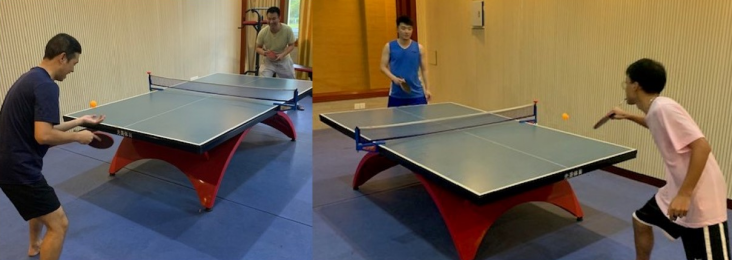
The image size is (732, 260). I want to click on front table legs, so click(113, 171), click(209, 204), click(466, 254), click(580, 223).